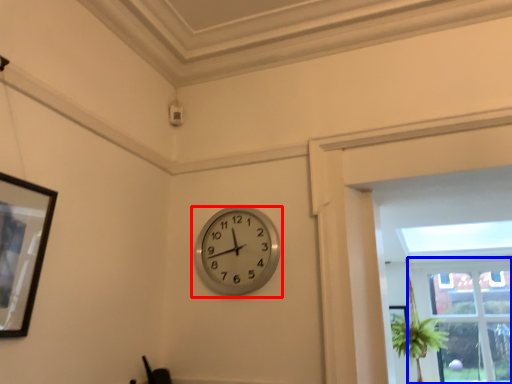
Question: Among these objects, which one is farthest to the camera, wall clock (highlighted by a red box) or window (highlighted by a blue box)?

Choices:
 (A) wall clock
 (B) window

Answer: (B)